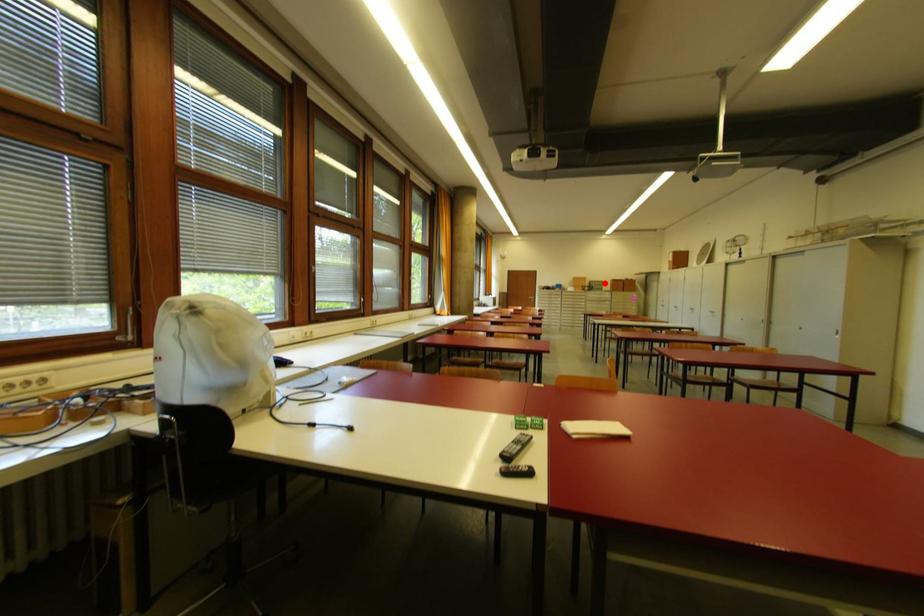
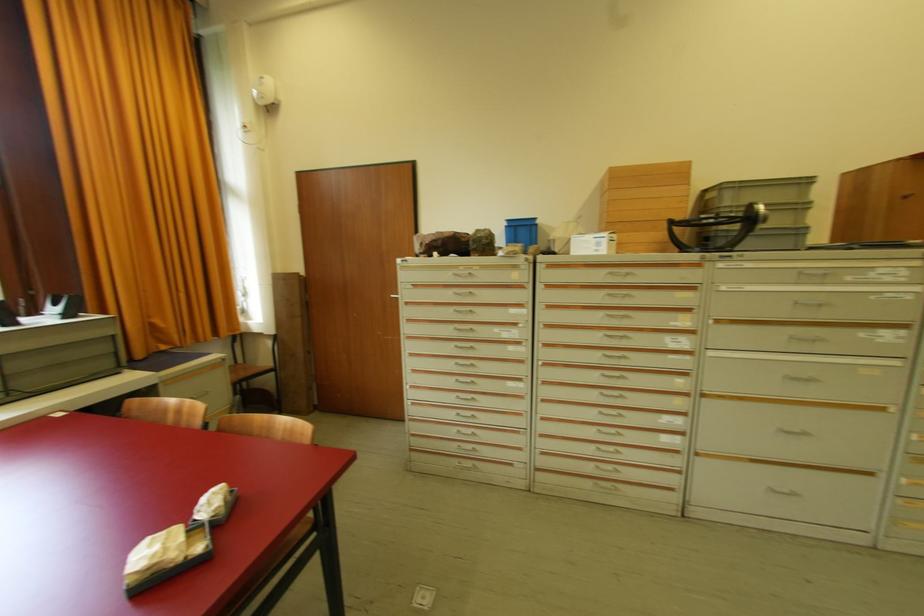
The point at the highlighted location is marked in the first image. Where is the corresponding point in the second image?

(809, 184)